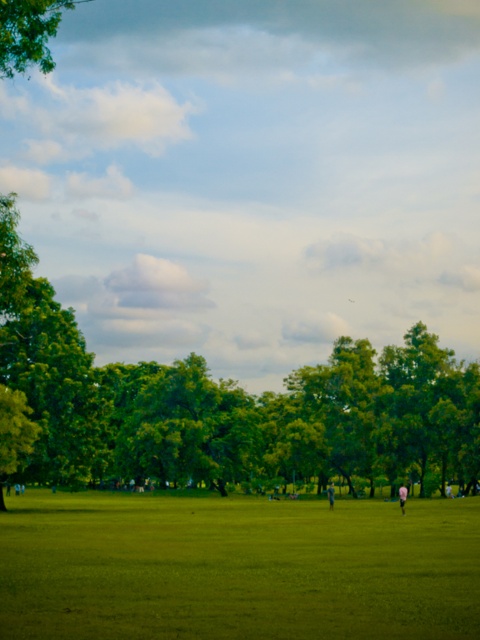
Is green grassy field at center positioned behind light blue cotton shirt at center?

That is False.

Where is `green grassy field at center`? This screenshot has width=480, height=640. green grassy field at center is located at coordinates (237, 568).

Is pink fabric person at center smaller than light blue cotton shirt at center?

No, pink fabric person at center is not smaller than light blue cotton shirt at center.

The image size is (480, 640). I want to click on pink fabric person at center, so click(403, 497).

Find the location of `pink fabric person at center`. pink fabric person at center is located at coordinates (403, 497).

Is the position of green grassy field at center more distant than that of pink fabric person at center?

No, green grassy field at center is closer to the viewer.

The height and width of the screenshot is (640, 480). What do you see at coordinates (237, 568) in the screenshot? I see `green grassy field at center` at bounding box center [237, 568].

Find the location of a particular element. The height and width of the screenshot is (640, 480). green grassy field at center is located at coordinates (237, 568).